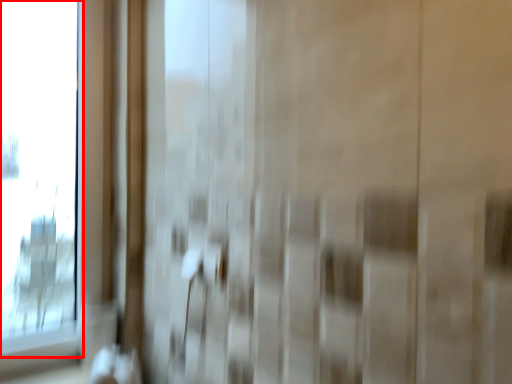
Question: Observing the image, what is the correct spatial positioning of window (annotated by the red box) in reference to door handle?

Choices:
 (A) left
 (B) right

Answer: (A)